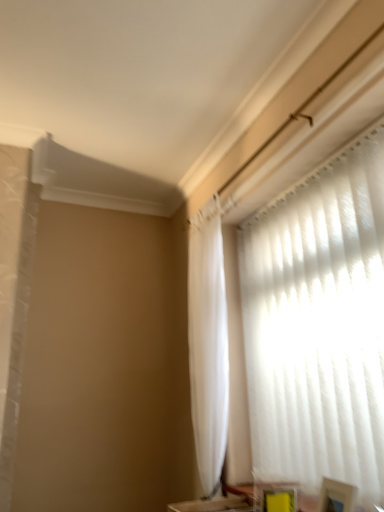
What do you see at coordinates (208, 343) in the screenshot?
I see `white sheer curtain at upper right` at bounding box center [208, 343].

Find the location of a particular element. white sheer curtain at upper right is located at coordinates (208, 343).

What is the approximate height of white sheer curtain at upper right?

white sheer curtain at upper right is 4.91 feet tall.

Find the location of a particular element. Image resolution: width=384 pixels, height=512 pixels. white sheer curtain at upper right is located at coordinates (208, 343).